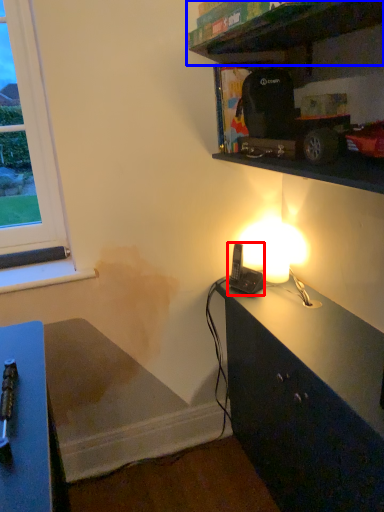
Question: Which object appears closest to the camera in this image, equipment (highlighted by a red box) or shelf (highlighted by a blue box)?

Choices:
 (A) equipment
 (B) shelf

Answer: (B)